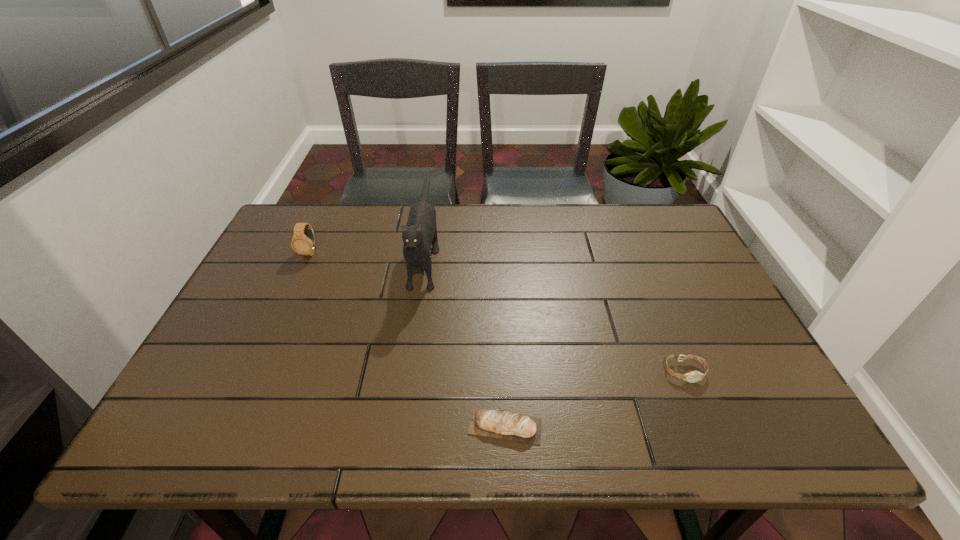
Where is `free space between the leftmost object and the second nearest object`? Image resolution: width=960 pixels, height=540 pixels. free space between the leftmost object and the second nearest object is located at coordinates (497, 312).

At what (x,y) coordinates should I click in order to perform the action: click on free area in between the nearest object and the right watch. Please return your answer as a coordinate pair (x, y). Looking at the image, I should click on click(x=594, y=399).

In order to click on vacant region between the second object from right to left and the nearer watch in this screenshot , I will do `click(594, 399)`.

At what (x,y) coordinates should I click in order to perform the action: click on free area in between the taller watch and the third object from left to right. Please return your answer as a coordinate pair (x, y). The width and height of the screenshot is (960, 540). Looking at the image, I should click on (408, 340).

Locate which object is the closest to the right watch. Please provide its 2D coordinates. Your answer should be formatted as a tuple, i.e. [(x, y)], where the tuple contains the x and y coordinates of a point satisfying the conditions above.

[(505, 425)]

Locate which object is the third closest to the second tallest object. Please provide its 2D coordinates. Your answer should be formatted as a tuple, i.e. [(x, y)], where the tuple contains the x and y coordinates of a point satisfying the conditions above.

[(694, 376)]

The height and width of the screenshot is (540, 960). In order to click on free space that satisfies the following two spatial constraints: 1. on the face of the farther watch; 2. on the right side of the third object from left to right in this screenshot , I will do `click(230, 426)`.

Locate an element on the screen. blank space that satisfies the following two spatial constraints: 1. on the front-facing side of the third object from right to left; 2. on the left side of the pita bread is located at coordinates pos(400,426).

What are the coordinates of `free point that satisfies the following two spatial constraints: 1. on the face of the third shortest object; 2. on the right side of the pita bread` in the screenshot? It's located at (230, 426).